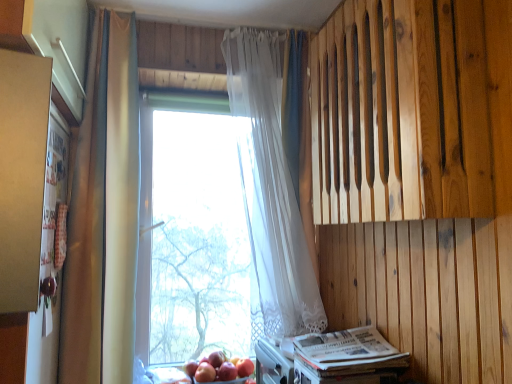
Question: Would you say white sheer curtain at center, placed as the 1th curtain when sorted from right to left, is outside red matte apple at lower center, acting as the 1th apple starting from the right?

Choices:
 (A) no
 (B) yes

Answer: (B)

Question: Is white sheer curtain at center, placed as the 1th curtain when sorted from right to left, further to the viewer compared to red matte apple at lower center, marked as the third apple in a left-to-right arrangement?

Choices:
 (A) yes
 (B) no

Answer: (B)

Question: Does white sheer curtain at center, the second curtain positioned from the left, appear on the left side of red matte apple at lower center, acting as the 1th apple starting from the right?

Choices:
 (A) no
 (B) yes

Answer: (A)

Question: From the image's perspective, does white sheer curtain at center, the second curtain positioned from the left, appear lower than red matte apple at lower center, marked as the third apple in a left-to-right arrangement?

Choices:
 (A) no
 (B) yes

Answer: (A)

Question: From the image's perspective, would you say white sheer curtain at center, placed as the 1th curtain when sorted from right to left, is positioned over red matte apple at lower center, acting as the 1th apple starting from the right?

Choices:
 (A) yes
 (B) no

Answer: (A)

Question: Is white sheer curtain at center, placed as the 1th curtain when sorted from right to left, oriented towards red matte apple at lower center, acting as the 1th apple starting from the right?

Choices:
 (A) no
 (B) yes

Answer: (A)

Question: Considering the relative sizes of red matte apple at lower center, marked as the third apple in a left-to-right arrangement, and red matte apple at lower center, acting as the 1th apple starting from the left, in the image provided, is red matte apple at lower center, marked as the third apple in a left-to-right arrangement, wider than red matte apple at lower center, acting as the 1th apple starting from the left,?

Choices:
 (A) no
 (B) yes

Answer: (A)

Question: Considering the relative sizes of red matte apple at lower center, marked as the third apple in a left-to-right arrangement, and red matte apple at lower center, acting as the 1th apple starting from the left, in the image provided, is red matte apple at lower center, marked as the third apple in a left-to-right arrangement, thinner than red matte apple at lower center, acting as the 1th apple starting from the left,?

Choices:
 (A) yes
 (B) no

Answer: (A)

Question: Can you confirm if red matte apple at lower center, acting as the 1th apple starting from the right, is taller than red matte apple at lower center, placed as the 3th apple when sorted from right to left?

Choices:
 (A) no
 (B) yes

Answer: (B)

Question: Is red matte apple at lower center, marked as the third apple in a left-to-right arrangement, to the left of red matte apple at lower center, placed as the 3th apple when sorted from right to left, from the viewer's perspective?

Choices:
 (A) no
 (B) yes

Answer: (A)

Question: From the image's perspective, would you say red matte apple at lower center, marked as the third apple in a left-to-right arrangement, is positioned over red matte apple at lower center, acting as the 1th apple starting from the left?

Choices:
 (A) yes
 (B) no

Answer: (A)

Question: Is red matte apple at lower center, acting as the 1th apple starting from the right, not inside red matte apple at lower center, acting as the 1th apple starting from the left?

Choices:
 (A) no
 (B) yes

Answer: (B)

Question: Considering the relative sizes of white paper magazine at lower right and matte gold curtain at left, the first curtain when ordered from left to right, in the image provided, is white paper magazine at lower right taller than matte gold curtain at left, the first curtain when ordered from left to right,?

Choices:
 (A) no
 (B) yes

Answer: (A)